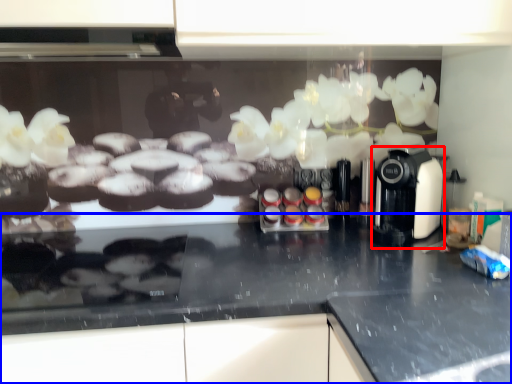
Question: Which object appears farthest to the camera in this image, coffee machine (highlighted by a red box) or countertop (highlighted by a blue box)?

Choices:
 (A) coffee machine
 (B) countertop

Answer: (A)